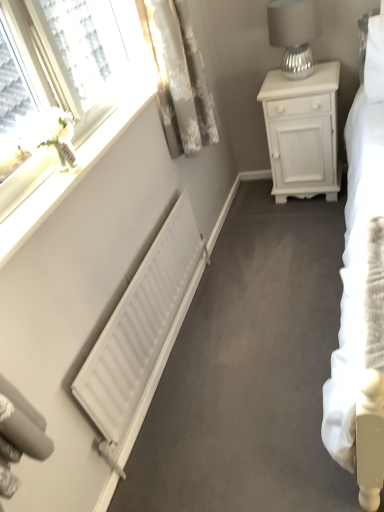
Where is `vacant space underneath white textured curtain at upper left (from a real-world perspective)`? vacant space underneath white textured curtain at upper left (from a real-world perspective) is located at coordinates (227, 241).